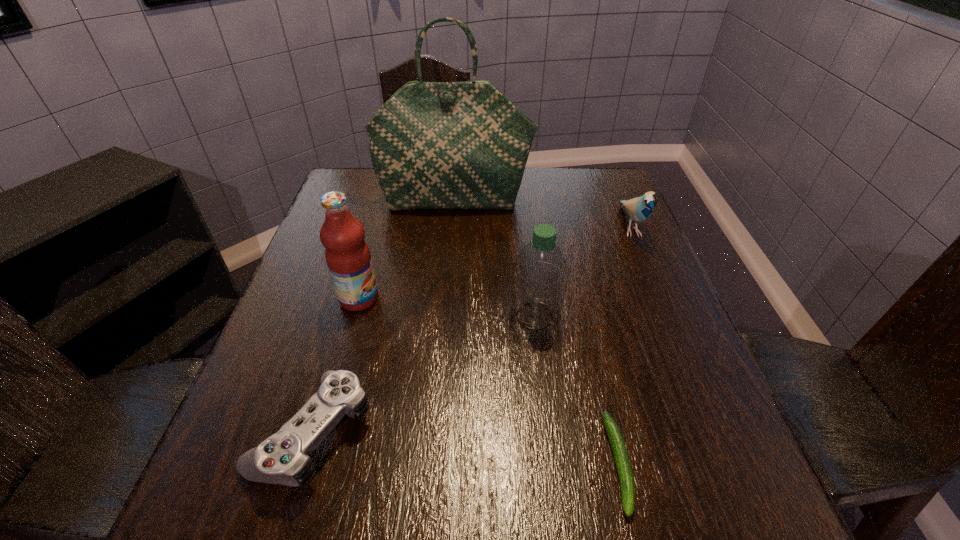
Where is `free space located 0.200m on the front of the water bottle`? The width and height of the screenshot is (960, 540). free space located 0.200m on the front of the water bottle is located at coordinates (548, 429).

Identify the location of free space located 0.200m at the face of the rightmost object. (666, 313).

Find the location of `free space located on the right of the fifth tallest object`. free space located on the right of the fifth tallest object is located at coordinates (467, 430).

Where is `tote bag located in the far edge section of the desktop`? tote bag located in the far edge section of the desktop is located at coordinates (x=434, y=145).

Image resolution: width=960 pixels, height=540 pixels. In order to click on bird present at the far edge in this screenshot , I will do `click(639, 209)`.

You are a GUI agent. You are given a task and a screenshot of the screen. Output one action in this format:
    pyautogui.click(x=<x>, y=<y>)
    Task: Click on the control located in the near edge section of the desktop
    
    Given the screenshot: What is the action you would take?
    pyautogui.click(x=283, y=458)

At what (x,y) coordinates should I click in order to perform the action: click on zucchini present at the near edge. Please return your answer as a coordinate pair (x, y). This screenshot has height=540, width=960. Looking at the image, I should click on (623, 465).

This screenshot has height=540, width=960. What are the coordinates of `tote bag at the left edge` in the screenshot? It's located at (434, 145).

Find the location of `fruit juice located in the left edge section of the desktop`. fruit juice located in the left edge section of the desktop is located at coordinates (348, 258).

Identify the location of control that is at the left edge. (283, 458).